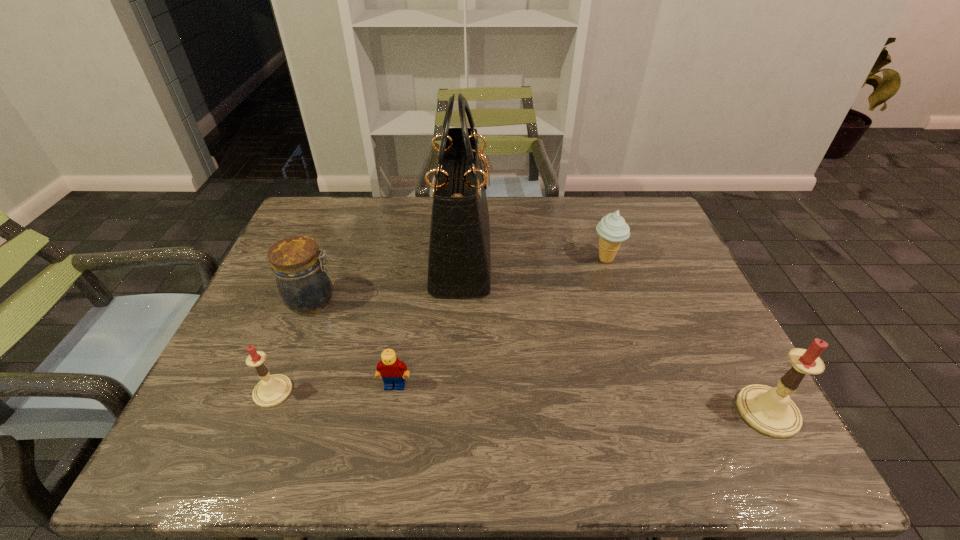
Where is `vacant region located on the left of the fifth shortest object`? The height and width of the screenshot is (540, 960). vacant region located on the left of the fifth shortest object is located at coordinates tap(690, 411).

The height and width of the screenshot is (540, 960). I want to click on free spot located 0.190m on the front of the fifth object from left to right, so click(x=626, y=320).

Find the location of a particular element. vacant point located at the front of the fourth object from left to right with visible charms is located at coordinates (562, 256).

Locate an element on the screen. free space located 0.330m on the lid of the jar is located at coordinates (466, 300).

Where is `object present at the far edge`? object present at the far edge is located at coordinates (459, 264).

I want to click on Lego that is at the near edge, so pyautogui.click(x=392, y=371).

Find the location of a particular element. The image size is (960, 540). candle present at the left edge is located at coordinates (272, 390).

The width and height of the screenshot is (960, 540). What are the coordinates of `jar positioned at the left edge` in the screenshot? It's located at (303, 282).

You are a GUI agent. You are given a task and a screenshot of the screen. Output one action in this format:
    pyautogui.click(x=<x>, y=<y>)
    Task: Click on the object that is positioned at the right edge
    This screenshot has width=960, height=540.
    Given the screenshot: What is the action you would take?
    pyautogui.click(x=769, y=410)

I want to click on object located at the near left corner, so click(272, 390).